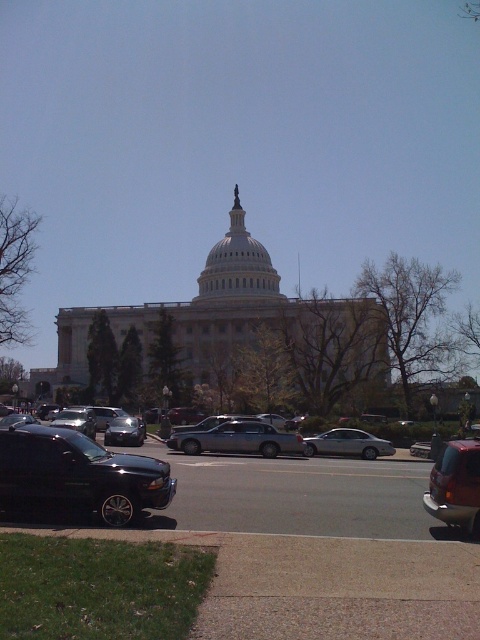
Is shiny black suv at lower left positioned at the back of metallic red suv at right?

That is True.

Between shiny black suv at lower left and metallic red suv at right, which one is positioned higher?

shiny black suv at lower left is above.

Where is `shiny black suv at lower left`? The width and height of the screenshot is (480, 640). shiny black suv at lower left is located at coordinates (79, 474).

Between point (432, 528) and point (382, 438), which one is positioned behind?

The point (382, 438) is behind.

Is shiny black sedan at center taller than silver metallic sedan at center?

Incorrect, shiny black sedan at center's height is not larger of silver metallic sedan at center's.

Find the location of `shiny black sedan at center`. shiny black sedan at center is located at coordinates (297, 493).

Does metallic red suv at right have a lesser width compared to silver metallic sedan at center?

Yes, metallic red suv at right is thinner than silver metallic sedan at center.

Consider the image. Does metallic red suv at right have a lesser height compared to silver metallic sedan at center?

No.

Image resolution: width=480 pixels, height=640 pixels. What do you see at coordinates (456, 484) in the screenshot?
I see `metallic red suv at right` at bounding box center [456, 484].

At what (x,y) coordinates should I click in order to perform the action: click on metallic red suv at right. Please return your answer as a coordinate pair (x, y). This screenshot has height=640, width=480. Looking at the image, I should click on (456, 484).